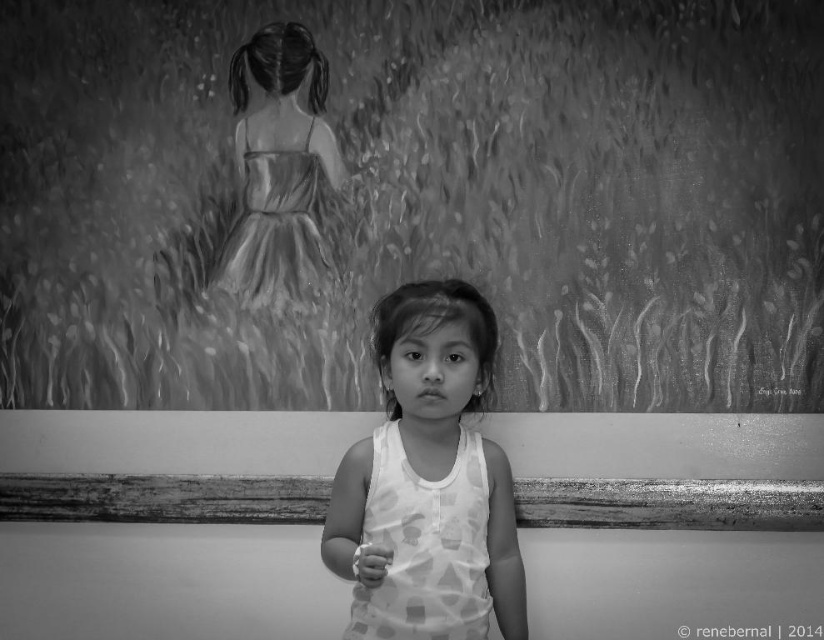
Can you confirm if white dotted tank top at center is positioned to the left of satin-like dress at upper center?

In fact, white dotted tank top at center is to the right of satin-like dress at upper center.

Who is shorter, white dotted tank top at center or satin-like dress at upper center?

Standing shorter between the two is white dotted tank top at center.

Between point (445, 582) and point (300, 179), which one is positioned behind?

Positioned behind is point (300, 179).

Where is `white dotted tank top at center`? This screenshot has height=640, width=824. white dotted tank top at center is located at coordinates (433, 368).

Between white dotted tank top at center and white dotted fabric dress at center, which one appears on the left side from the viewer's perspective?

From the viewer's perspective, white dotted tank top at center appears more on the left side.

Which is behind, point (408, 328) or point (373, 541)?

Positioned behind is point (408, 328).

Where is `white dotted tank top at center`? Image resolution: width=824 pixels, height=640 pixels. white dotted tank top at center is located at coordinates (433, 368).

Who is taller, white dotted fabric dress at center or satin-like dress at upper center?

Standing taller between the two is satin-like dress at upper center.

Does white dotted fabric dress at center have a greater width compared to satin-like dress at upper center?

In fact, white dotted fabric dress at center might be narrower than satin-like dress at upper center.

Locate an element on the screen. This screenshot has width=824, height=640. white dotted fabric dress at center is located at coordinates (424, 545).